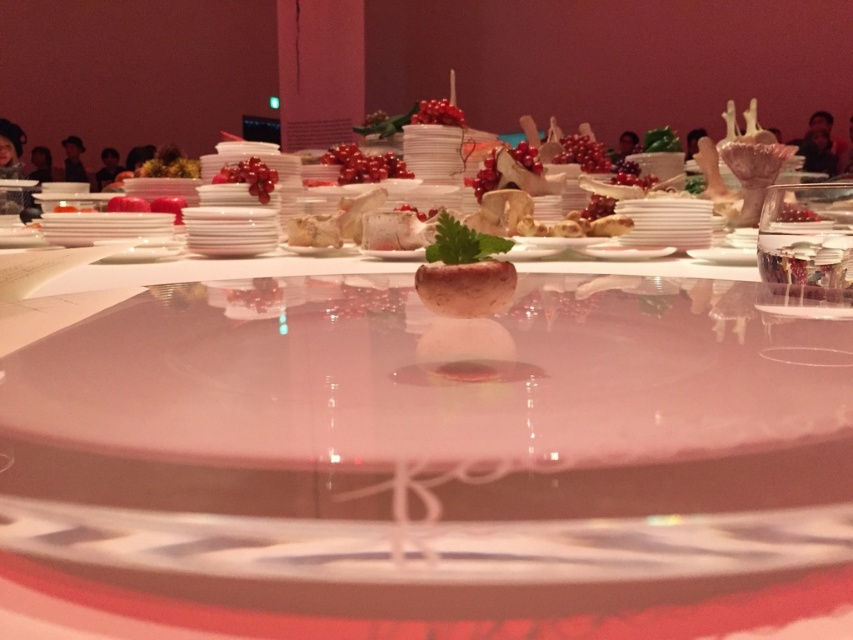
Question: Which point is farther to the camera?

Choices:
 (A) (368, 168)
 (B) (589, 292)

Answer: (A)

Question: Which object is closer to the camera taking this photo?

Choices:
 (A) clear acrylic table at center
 (B) glossy red berries at center

Answer: (A)

Question: Is shiny red berries at center above shiny red berries at upper center?

Choices:
 (A) yes
 (B) no

Answer: (A)

Question: Is clear acrylic table at center thinner than shiny red berries at center?

Choices:
 (A) no
 (B) yes

Answer: (A)

Question: Is shiny red berries at upper center positioned behind glossy red berries at center?

Choices:
 (A) yes
 (B) no

Answer: (B)

Question: Which is farther from the shiny red berries at center?

Choices:
 (A) clear acrylic table at center
 (B) glossy red berries at center
 (C) shiny red berries at upper center

Answer: (A)